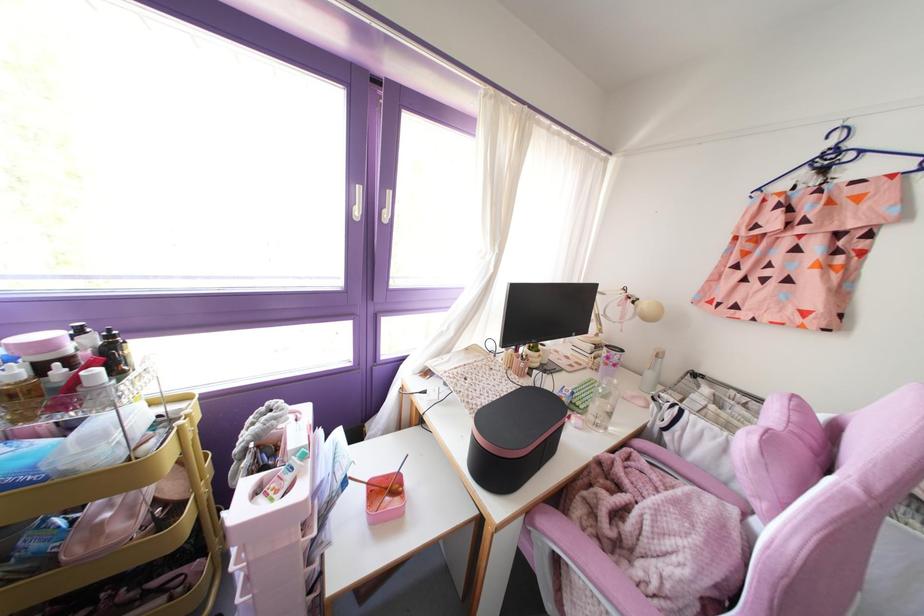
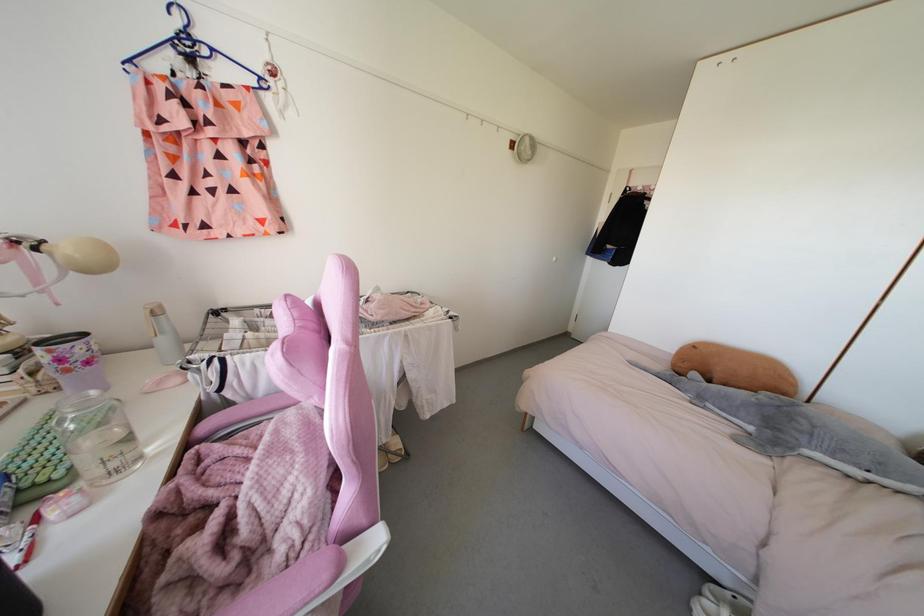
The point at (x=614, y=381) is marked in the first image. Where is the corresponding point in the second image?

(92, 392)